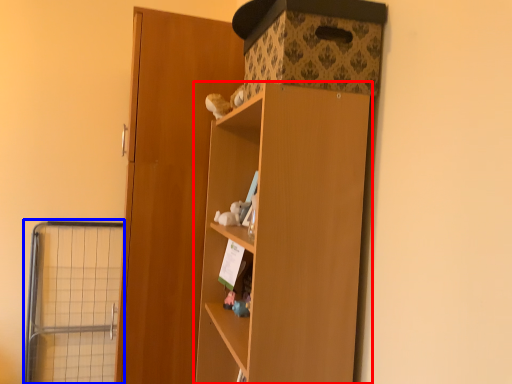
Question: Among these objects, which one is nearest to the camera, cupboard (highlighted by a red box) or cage (highlighted by a blue box)?

Choices:
 (A) cupboard
 (B) cage

Answer: (A)